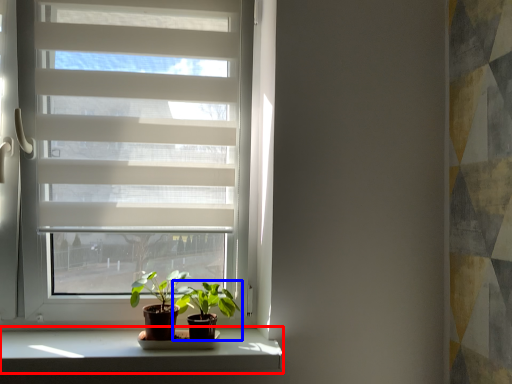
Question: Among these objects, which one is farthest to the camera, window sill (highlighted by a red box) or houseplant (highlighted by a blue box)?

Choices:
 (A) window sill
 (B) houseplant

Answer: (B)